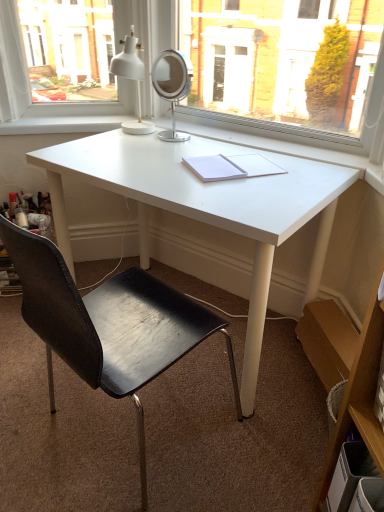
Question: Does point (226, 170) appear closer or farther from the camera than point (71, 290)?

Choices:
 (A) farther
 (B) closer

Answer: (A)

Question: From their relative heights in the image, would you say white paper notebook at center is taller or shorter than black leather chair at center?

Choices:
 (A) short
 (B) tall

Answer: (A)

Question: Estimate the real-world distances between objects in this image. Which object is farther from the wooden shelf at right?

Choices:
 (A) black leather chair at center
 (B) white matte desk at center
 (C) white matte table lamp at upper center
 (D) white paper notebook at center

Answer: (C)

Question: Which is nearer to the white matte table lamp at upper center?

Choices:
 (A) white paper notebook at center
 (B) white matte desk at center
 (C) black leather chair at center
 (D) wooden shelf at right

Answer: (B)